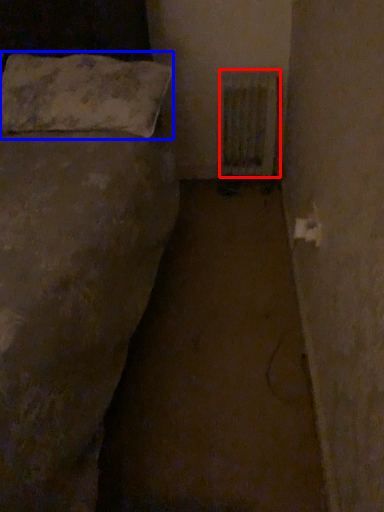
Question: Which of the following is the closest to the observer, radiator (highlighted by a red box) or pillow (highlighted by a blue box)?

Choices:
 (A) radiator
 (B) pillow

Answer: (B)